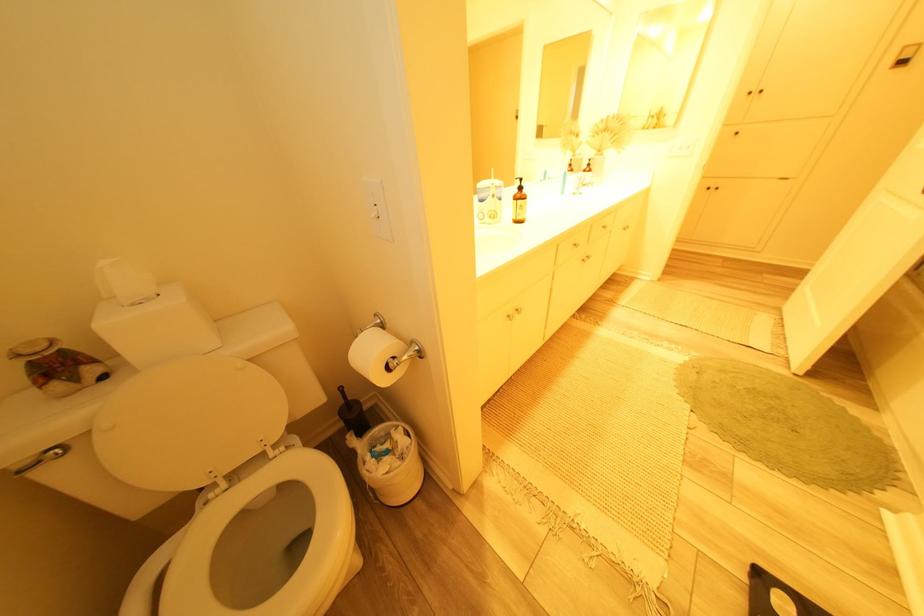
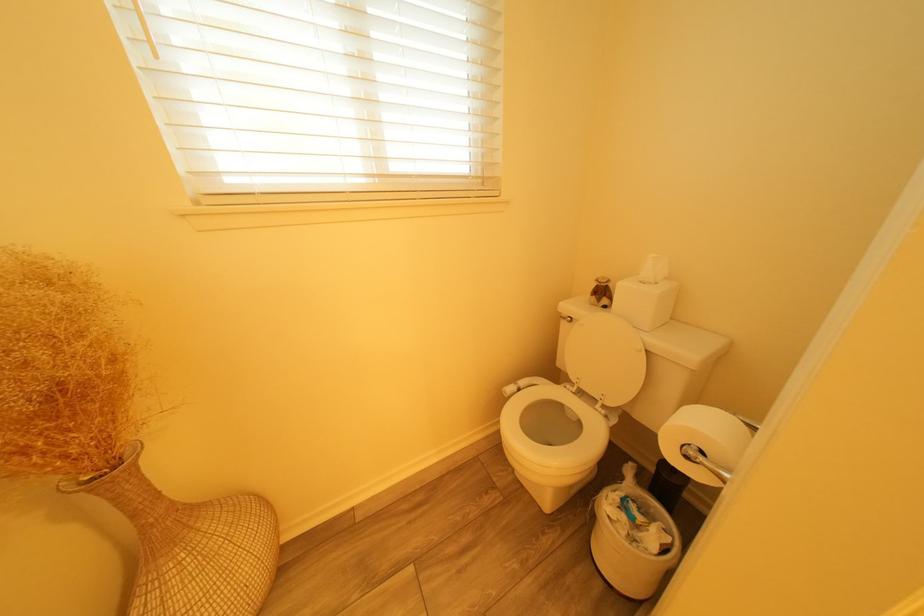
In the second image, find the point that corresponds to (x=274, y=455) in the first image.

(608, 403)